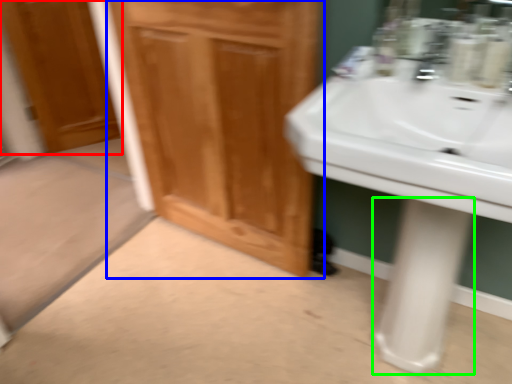
Question: Which object is positioned farthest from door (highlighted by a red box)? Select from bathroom cabinet (highlighted by a blue box) and pillar (highlighted by a green box).

Choices:
 (A) bathroom cabinet
 (B) pillar

Answer: (B)